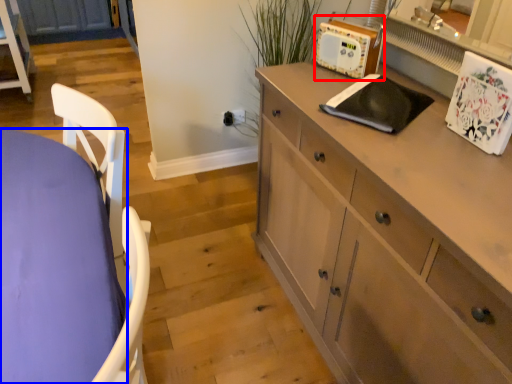
Question: Which of the following is the closest to the observer, appliance (highlighted by a red box) or desk (highlighted by a blue box)?

Choices:
 (A) appliance
 (B) desk

Answer: (B)